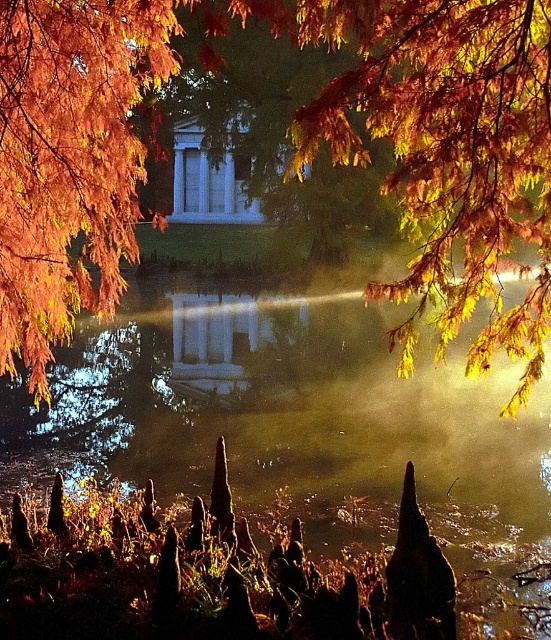
You are standing in the serene scene and want to pick up the orange leafy branch at upper left. Based on its location at point (x=293, y=154), where exactly should you look to find it?

The orange leafy branch at upper left is located at point (x=293, y=154), so you should look towards the upper left area of the scene to find it.

You are a gardener standing at the edge of the pond and need to reach both the orange leafy branch at upper left and the orange matte leaves at upper left. Given that your longest tool can extend 4 meters, can you reach both objects with a single tool?

The orange leafy branch at upper left and orange matte leaves at upper left are 4.37 meters apart from each other. Since your tool can only extend 4 meters, you cannot reach both objects with a single tool as the distance between them exceeds the tool length.

You are standing at the edge of the pond and want to take a photo of the orange matte leaves at upper left. If your camera has a maximum focus distance of 25 feet, will you be able to capture them clearly?

The orange matte leaves at upper left are 26.56 feet away from the camera, which exceeds the maximum focus distance of 25 feet. Therefore, you won